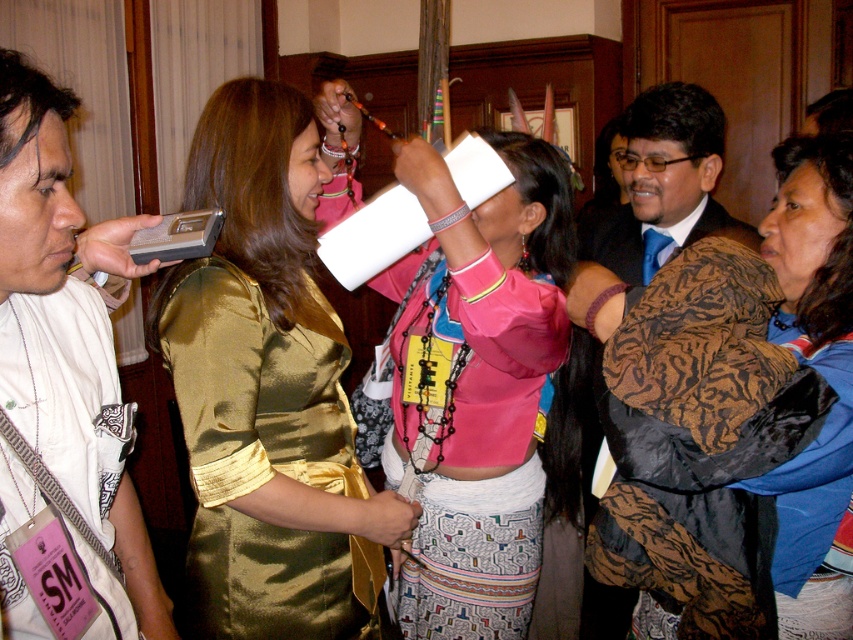
Which of these two, pink satin blouse at center or white fabric at left, stands shorter?

white fabric at left

Does pink satin blouse at center have a greater height compared to white fabric at left?

Yes, pink satin blouse at center is taller than white fabric at left.

You are a GUI agent. You are given a task and a screenshot of the screen. Output one action in this format:
    pyautogui.click(x=<x>, y=<y>)
    Task: Click on the pink satin blouse at center
    
    Given the screenshot: What is the action you would take?
    pyautogui.click(x=480, y=387)

This screenshot has height=640, width=853. I want to click on pink satin blouse at center, so click(480, 387).

Who is more distant from viewer, [682,412] or [61,292]?

Positioned behind is point [61,292].

Does patterned fabric scarf at center have a greater height compared to white fabric at left?

In fact, patterned fabric scarf at center may be shorter than white fabric at left.

Who is more forward, (780, 476) or (86, 273)?

Point (780, 476) is in front.

Find the location of a particular element. Image resolution: width=853 pixels, height=640 pixels. patterned fabric scarf at center is located at coordinates (737, 406).

Is gold satin dress at center wider than white fabric at left?

Correct, the width of gold satin dress at center exceeds that of white fabric at left.

Does gold satin dress at center have a smaller size compared to white fabric at left?

Actually, gold satin dress at center might be larger than white fabric at left.

Describe the element at coordinates (268, 388) in the screenshot. I see `gold satin dress at center` at that location.

The width and height of the screenshot is (853, 640). What are the coordinates of `gold satin dress at center` in the screenshot? It's located at (268, 388).